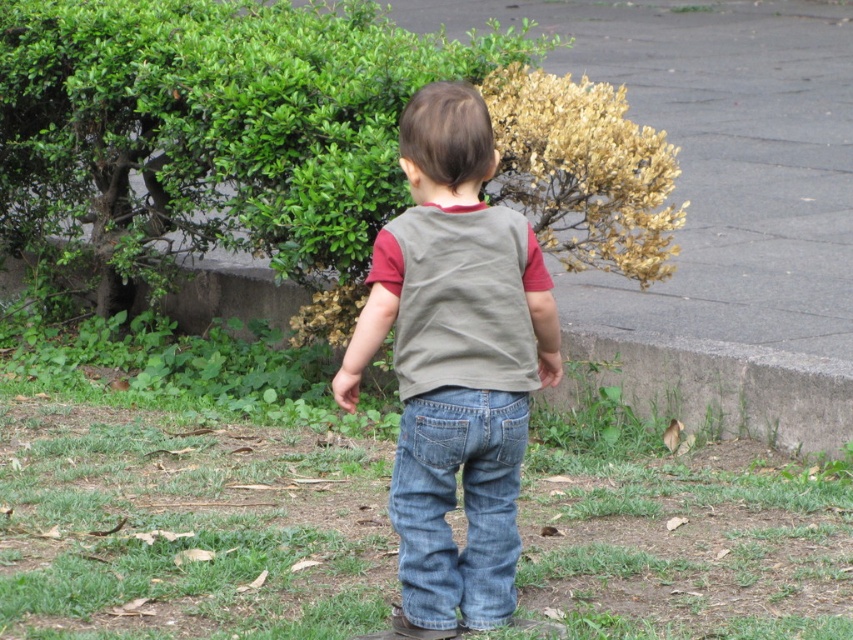
Question: Considering the relative positions of green grass at lower center and green leafy bush at upper center in the image provided, where is green grass at lower center located with respect to green leafy bush at upper center?

Choices:
 (A) left
 (B) right

Answer: (A)

Question: Which point is farther from the camera taking this photo?

Choices:
 (A) (180, 32)
 (B) (445, 132)
 (C) (345, 522)
 (D) (489, 541)

Answer: (A)

Question: Is denim jeans at center above denim jeans at lower center?

Choices:
 (A) yes
 (B) no

Answer: (A)

Question: Is green grass at lower center to the right of denim jeans at center from the viewer's perspective?

Choices:
 (A) yes
 (B) no

Answer: (B)

Question: Considering the real-world distances, which object is closest to the denim jeans at center?

Choices:
 (A) green grass at lower center
 (B) denim jeans at lower center
 (C) green leafy bush at upper center

Answer: (B)

Question: Which of the following is the farthest from the observer?

Choices:
 (A) denim jeans at center
 (B) green leafy bush at upper center

Answer: (B)